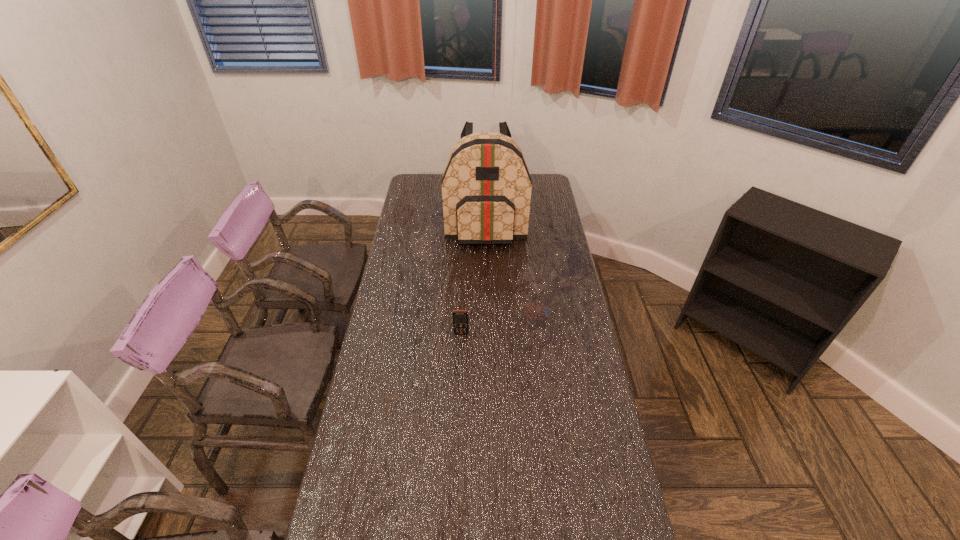
Where is `free space at the far edge of the desktop`? This screenshot has height=540, width=960. free space at the far edge of the desktop is located at coordinates (439, 192).

Image resolution: width=960 pixels, height=540 pixels. Identify the location of free region at the left edge of the desktop. (401, 405).

Identify the location of vacant space at the right edge of the desktop. The width and height of the screenshot is (960, 540). pos(547,328).

The image size is (960, 540). In order to click on free space between the backpack and the second farthest object in this screenshot , I will do `click(512, 267)`.

Find the location of a particular element. The height and width of the screenshot is (540, 960). vacant point located between the tallest object and the cellular telephone is located at coordinates (473, 278).

Where is `free space that is in between the shortest object and the second tallest object`? free space that is in between the shortest object and the second tallest object is located at coordinates (499, 322).

Locate an element on the screen. This screenshot has width=960, height=540. object identified as the closest to the second farthest object is located at coordinates (460, 317).

Select which object is the second closest to the backpack. Please provide its 2D coordinates. Your answer should be formatted as a tuple, i.e. [(x, y)], where the tuple contains the x and y coordinates of a point satisfying the conditions above.

[(460, 317)]

At what (x,y) coordinates should I click in order to perform the action: click on vacant area that satisfies the following two spatial constraints: 1. on the front face of the backpack; 2. on the left side of the second shortest object. Please return your answer as a coordinate pair (x, y). This screenshot has height=540, width=960. Looking at the image, I should click on (488, 311).